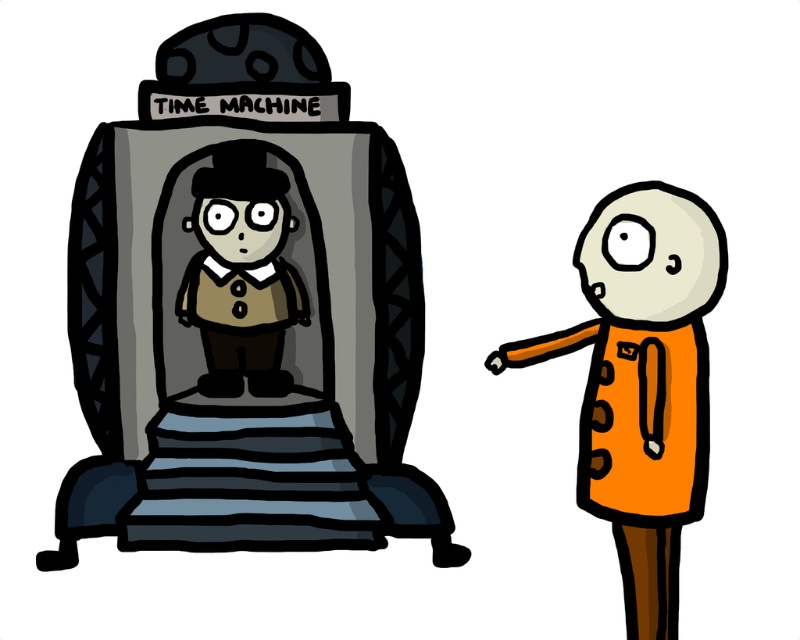
You are standing in front of the time machine in the cartoon scene. There is a control panel at point (246, 316). Is this control panel part of the matte gray time machine at center?

Yes, the point (246, 316) corresponds to the matte gray time machine at center, so the control panel is part of it.

You are standing in front of the matte gray time machine at center. If you want to reach a control panel located 5 feet away from the camera, can you reach it without moving from your current position?

The matte gray time machine at center is 4.60 feet away from the camera, so if the control panel is 5 feet away, you would need to move forward 0.40 feet to reach it.

What are the coordinates of the orange fabric coat at right in the image?

The orange fabric coat at right is located at coordinates point [642,381].